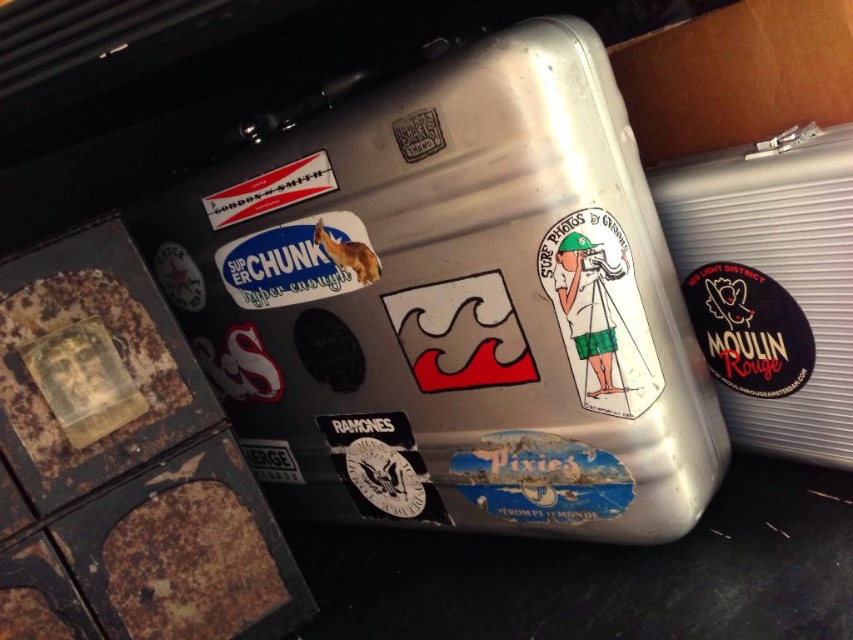
You are standing in front of a metallic suitcase with several stickers. You need to place a new sticker exactly at the center of the brushed metal cooler at center. What coordinates should you use?

The coordinates for the center of the brushed metal cooler at center are at point (456, 307).

You are standing in front of a metallic suitcase with several stickers. There is a black matte sticker at right. Based on their 2D positions, which sticker is closer to the bottom edge of the suitcase?

The black matte sticker at right is closer to the bottom edge of the suitcase because its 2D position at point (749, 330) places it near the lower part of the suitcase.

You are packing for a trip and need to fit your brushed metal cooler at center and black matte sticker at right into a narrow backpack compartment. Based on their sizes, which item should you place first to ensure both fit?

The brushed metal cooler at center is much taller than the black matte sticker at right, so you should place the taller cooler first in the backpack compartment to make space for the smaller sticker.